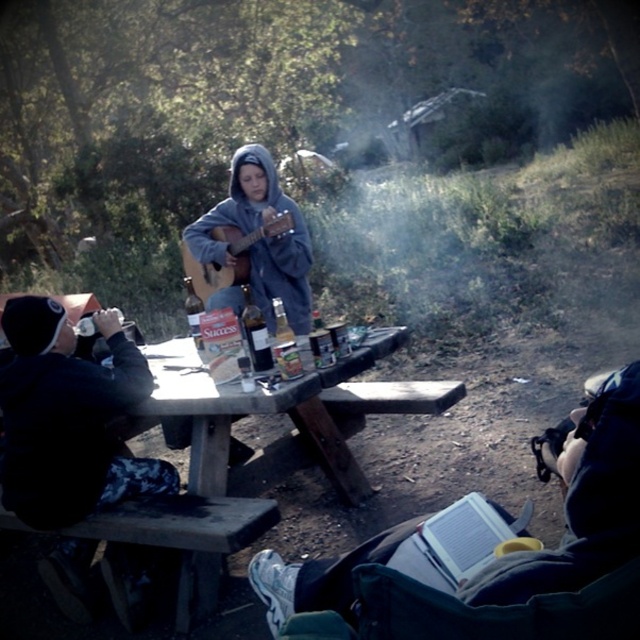
You are organizing a small picnic and need to place both the gray fleece hoodie at center and the clear glass bottle at center on a narrow shelf. Which item should you place first to ensure both fit without overlapping?

The clear glass bottle at center is narrower than the gray fleece hoodie at center, so place the clear glass bottle at center first to accommodate the wider hoodie afterward.

You are a photographer at the picnic table scene. You want to take a photo of the clear glass bottle at center without the gray fleece hoodie at center blocking the view. Is the bottle currently visible in your shot?

The clear glass bottle at center is behind gray fleece hoodie at center, so it is currently blocked and not visible in the shot.